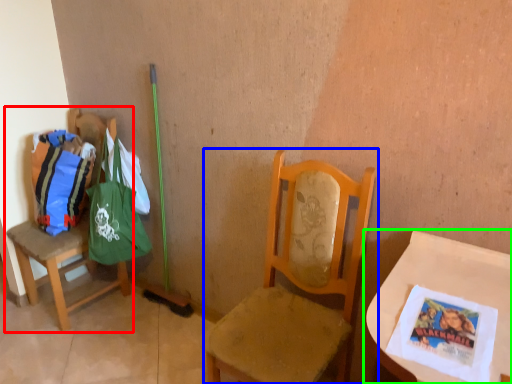
Question: Which is farther away from chair (highlighted by a red box)? chair (highlighted by a blue box) or table (highlighted by a green box)?

Choices:
 (A) chair
 (B) table

Answer: (B)